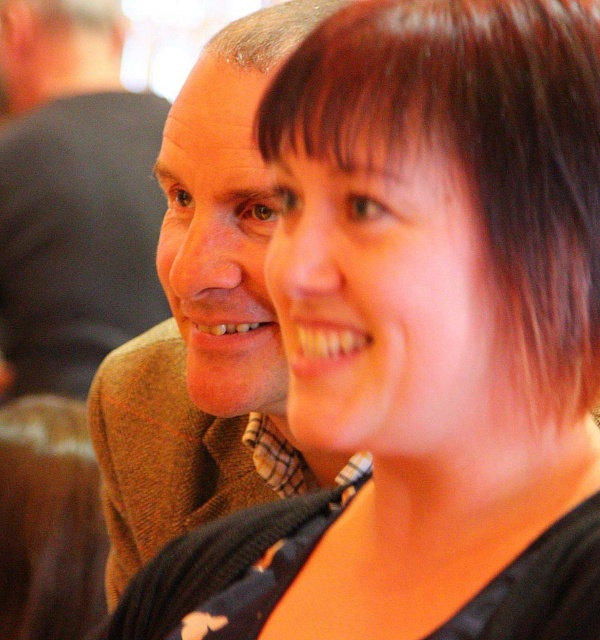
You are a photographer trying to capture a candid shot of the brown wool sweater at left and the gray matte hair at upper left. Which object should you focus on first to ensure both are in frame?

The brown wool sweater at left is much taller than the gray matte hair at upper left, so you should focus on the brown wool sweater at left first to ensure both are in frame.

You are holding a 12 inch ruler and want to measure the distance from the camera to the point at coordinates point (490, 129). Can your ruler reach that point?

The point at coordinates point (490, 129) is 16.57 inches from the camera. Since your ruler is only 12 inches long, it cannot reach that point.

You are at a social gathering and see two items in the image. The first is the brown wool sweater at left, and the second is the gray matte hair at upper left. Which item is positioned more to the left?

The brown wool sweater at left is positioned more to the left than the gray matte hair at upper left.